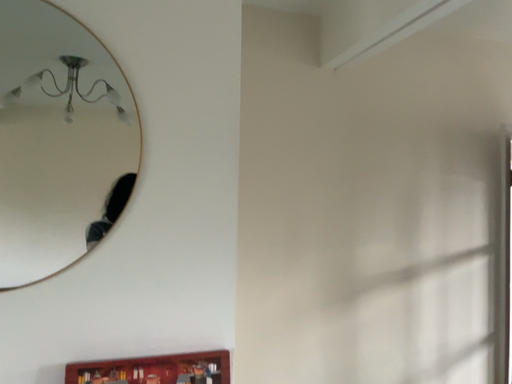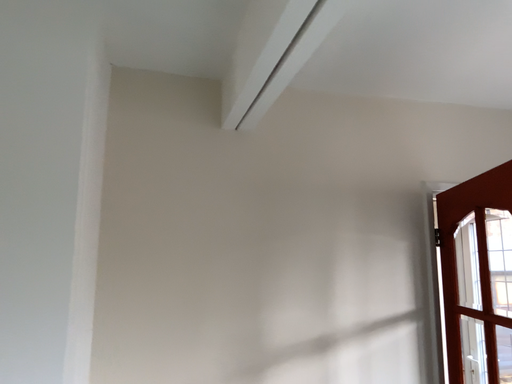
Question: How did the camera likely rotate when shooting the video?

Choices:
 (A) rotated downward
 (B) rotated upward

Answer: (B)